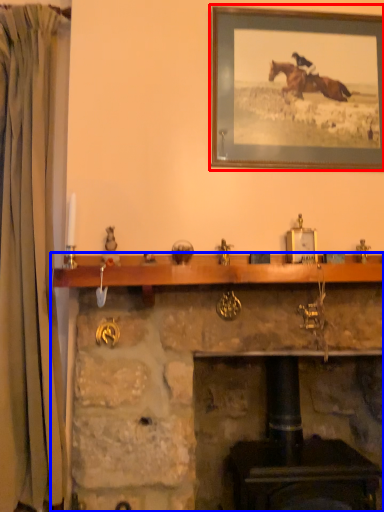
Question: Which object appears farthest to the camera in this image, picture frame (highlighted by a red box) or fireplace (highlighted by a blue box)?

Choices:
 (A) picture frame
 (B) fireplace

Answer: (A)